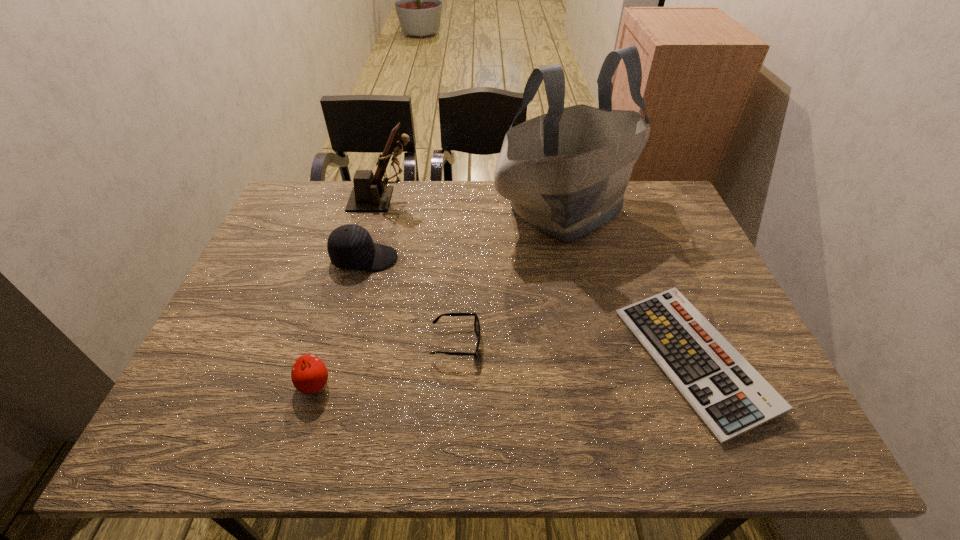
This screenshot has width=960, height=540. In order to click on vacant region located on the back of the apple in this screenshot , I will do `click(338, 304)`.

Image resolution: width=960 pixels, height=540 pixels. What are the coordinates of `free space located 0.360m on the front-facing side of the sunglasses` in the screenshot? It's located at (635, 342).

The height and width of the screenshot is (540, 960). I want to click on blank space located 0.130m on the left of the shortest object, so click(x=571, y=360).

Image resolution: width=960 pixels, height=540 pixels. I want to click on shopping bag that is at the far edge, so click(565, 172).

Locate an element on the screen. The image size is (960, 540). figurine at the far edge is located at coordinates (369, 194).

You are a GUI agent. You are given a task and a screenshot of the screen. Output one action in this format:
    pyautogui.click(x=<x>, y=<y>)
    Task: Click on the object that is at the near edge
    
    Given the screenshot: What is the action you would take?
    click(x=727, y=393)

Find the location of a particular element. Image resolution: width=960 pixels, height=540 pixels. shopping bag that is at the right edge is located at coordinates (565, 172).

Where is `computer keyboard at the right edge`? Image resolution: width=960 pixels, height=540 pixels. computer keyboard at the right edge is located at coordinates (727, 393).

This screenshot has height=540, width=960. I want to click on object that is positioned at the far right corner, so click(x=565, y=172).

The image size is (960, 540). Find the location of `object situated at the near right corner`. object situated at the near right corner is located at coordinates (727, 393).